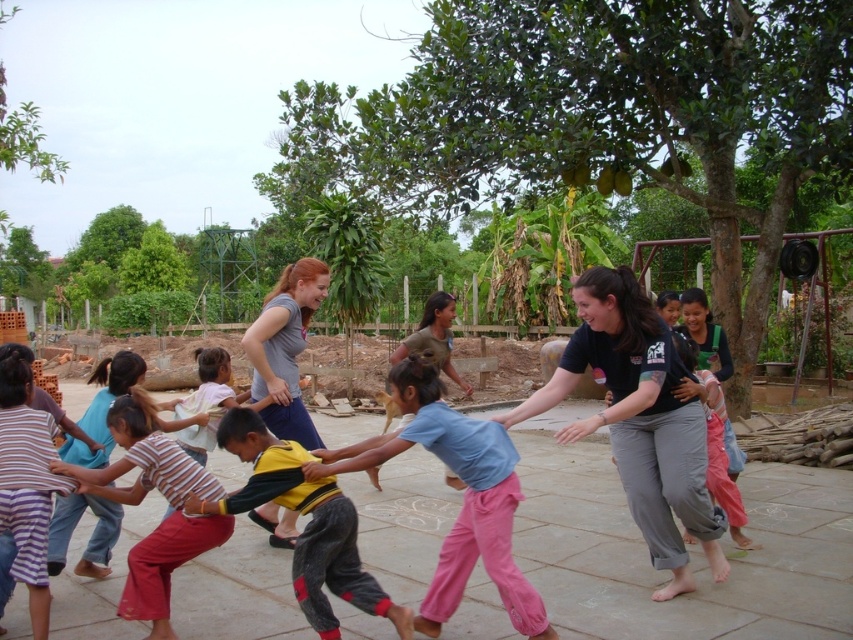
You are a photographer standing at the edge of the scene trying to capture a photo of both the striped cotton shirt at lower left and the smooth beige hand at center without any obstructions. Given that your camera has a maximum focus range of 1.2 meters, will you be able to get both subjects in focus at the same time?

The striped cotton shirt at lower left and smooth beige hand at center are 1.31 meters apart from each other. Since the distance between them exceeds the camera s maximum focus range of 1.2 meters, it will be challenging to capture both subjects in focus simultaneously.

You are standing at the origin point of the coordinate system. You want to move towards the striped fabric shirt at center. Which direction should you move in to reach it?

The striped fabric shirt at center is located at coordinate point 0.781 on the x axis and 0.166 on the y axis. Since you are at the origin, you should move towards the positive x and positive y directions to reach it.

You are standing in the middle of the tug of war scene and want to move towards the two points marked in the image. Which point, point (129, 499) or point (16, 371), is closer to you?

Point (129, 499) is closer to you because it is further to the viewer than point (16, 371).